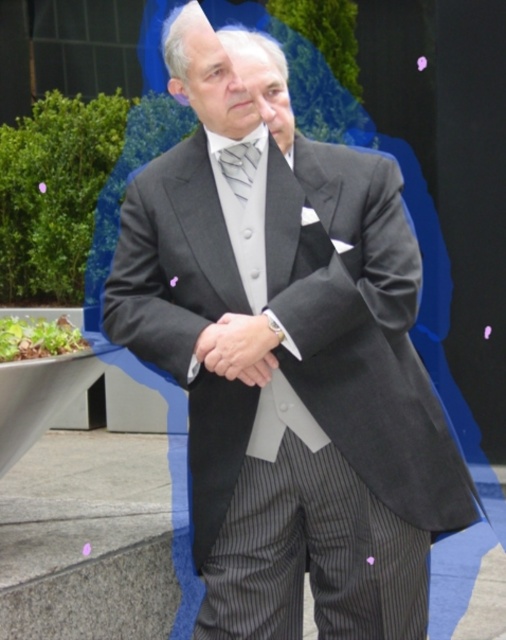
Question: Where is smooth gray suit at center located in relation to silvery metallic tie at center in the image?

Choices:
 (A) right
 (B) left

Answer: (A)

Question: Does smooth gray suit at center appear under silvery metallic tie at center?

Choices:
 (A) no
 (B) yes

Answer: (B)

Question: Among these objects, which one is nearest to the camera?

Choices:
 (A) silvery metallic tie at center
 (B) smooth gray suit at center

Answer: (B)

Question: Is smooth gray suit at center to the right of silvery metallic tie at center from the viewer's perspective?

Choices:
 (A) no
 (B) yes

Answer: (B)